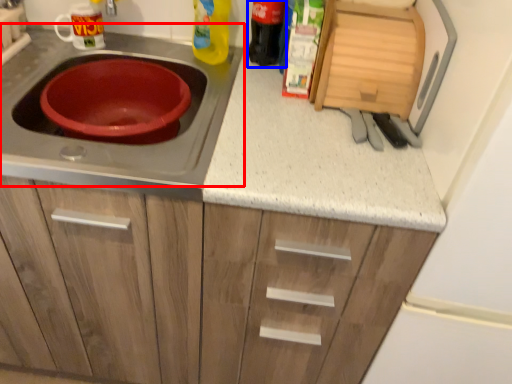
Question: Which of the following is the closest to the observer, gas stove (highlighted by a red box) or bottle (highlighted by a blue box)?

Choices:
 (A) gas stove
 (B) bottle

Answer: (A)